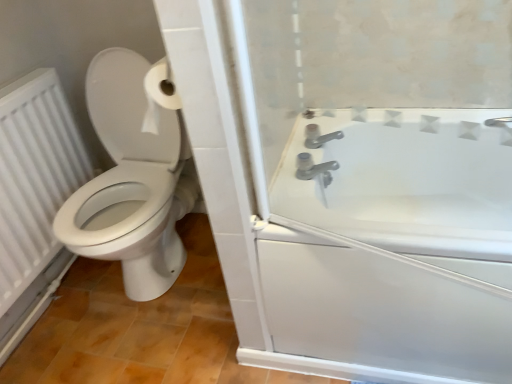
Question: Does point (77, 145) appear closer or farther from the camera than point (453, 13)?

Choices:
 (A) farther
 (B) closer

Answer: (A)

Question: Considering the positions of white textured radiator at left and white glossy bathtub at right in the image, is white textured radiator at left wider or thinner than white glossy bathtub at right?

Choices:
 (A) wide
 (B) thin

Answer: (B)

Question: Considering the real-world distances, which object is closest to the satin nickel faucet at upper right?

Choices:
 (A) white textured radiator at left
 (B) white glossy bathtub at right

Answer: (B)

Question: Considering the real-world distances, which object is farthest from the white glossy bathtub at right?

Choices:
 (A) satin nickel faucet at upper right
 (B) white textured radiator at left

Answer: (B)